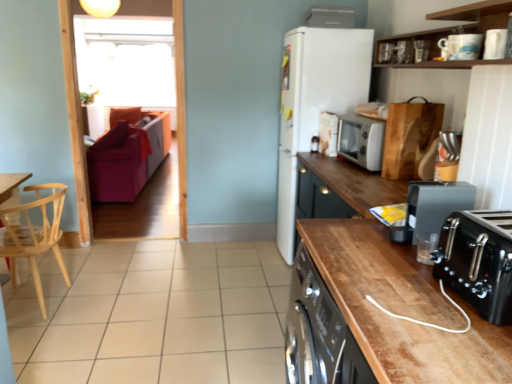
Find the location of a particular element. The image size is (512, 384). free point to the left of metallic gray coffee machine at right, marked as the second kitchen appliance in a top-to-bottom arrangement is located at coordinates (375, 240).